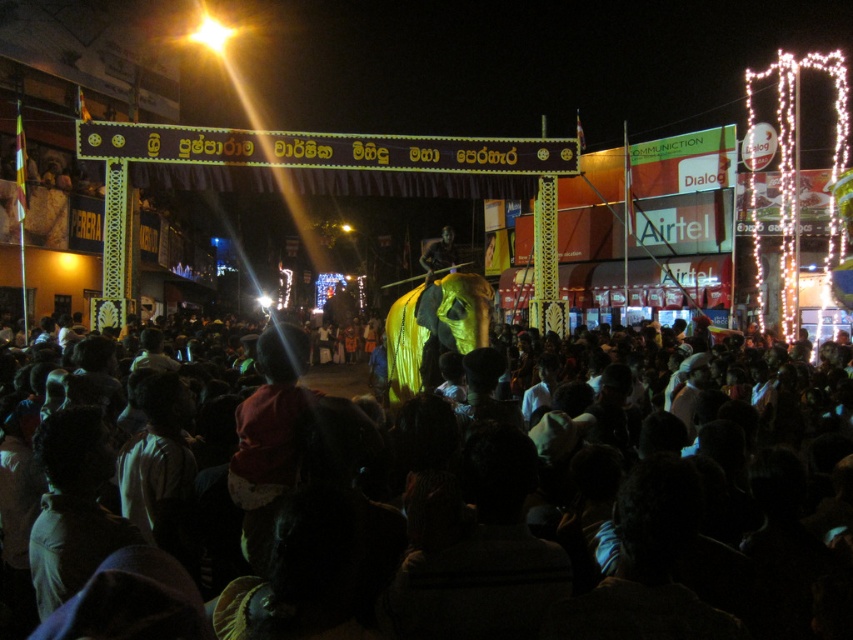
Does point (676, 596) lie in front of point (428, 284)?

Yes, point (676, 596) is closer to viewer.

Is dark brown hair at center wider than dark textured figure at center?

Correct, the width of dark brown hair at center exceeds that of dark textured figure at center.

Who is more distant from viewer, [436,636] or [451,234]?

The point [451,234] is behind.

Where is `dark brown hair at center`? dark brown hair at center is located at coordinates (508, 541).